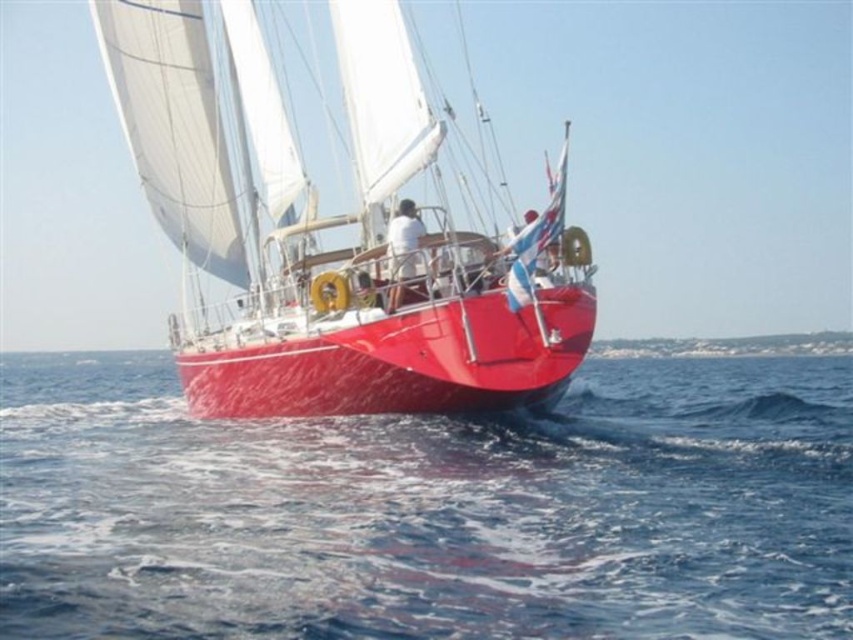
You are standing on a cliff overlooking the scene. You see the blue water at lower center and the shiny red sailboat at center. Which object is nearer to you?

The blue water at lower center is closer to the viewer than the shiny red sailboat at center.

You are standing on the dock and looking at the blue water at lower center and the shiny red sailboat at center. Which object is positioned to the right of the other?

The blue water at lower center is to the right of the shiny red sailboat at center according to the description.

You are a photographer trying to capture the shiny red sailboat at center and the blue water at lower center in a single frame. Which object should you focus on first if you want to ensure both are in the frame without moving the camera?

The shiny red sailboat at center is larger than the blue water at lower center, so focusing on the larger sailboat first would help ensure both fit in the frame.